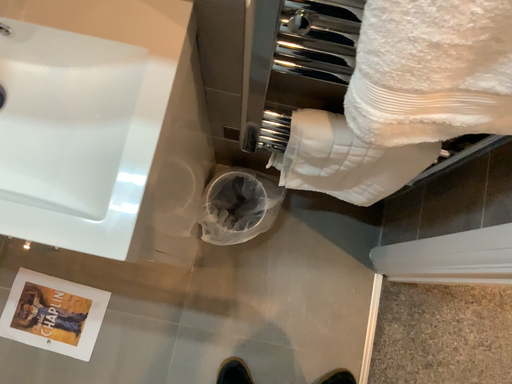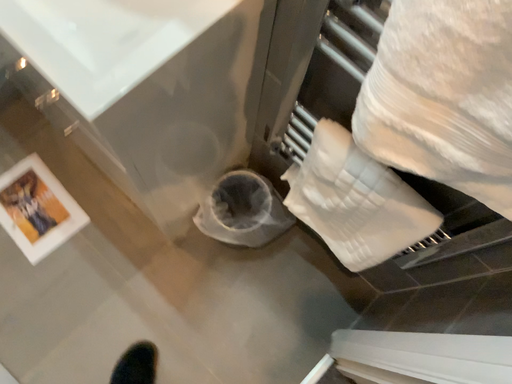
Question: How did the camera likely rotate when shooting the video?

Choices:
 (A) rotated downward
 (B) rotated upward

Answer: (B)